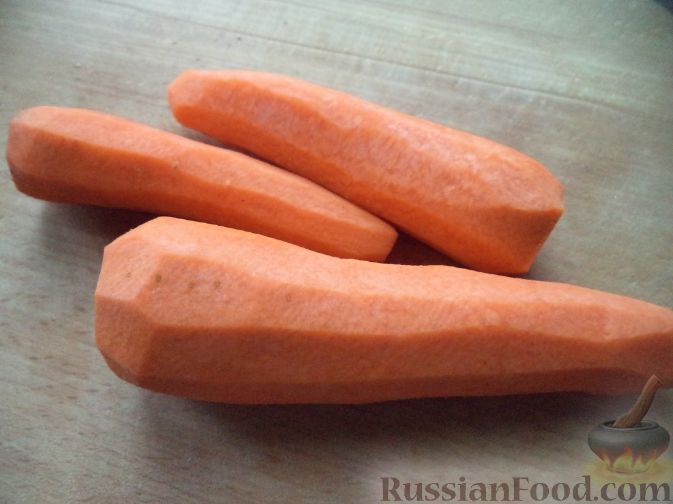
Identify the location of gray background color. (490, 60), (38, 388).